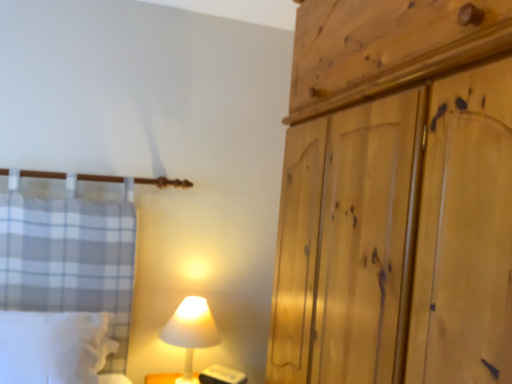
Question: From a real-world perspective, is white matte lamp at lower center positioned above or below white soft pillow at lower left?

Choices:
 (A) below
 (B) above

Answer: (A)

Question: From the image's perspective, is white matte lamp at lower center above or below white soft pillow at lower left?

Choices:
 (A) below
 (B) above

Answer: (A)

Question: Considering the real-world distances, which object is farthest from the white soft pillow at lower left?

Choices:
 (A) natural wood wardrobe at right
 (B) white matte lamp at lower center

Answer: (A)

Question: Based on their relative distances, which object is nearer to the white soft pillow at lower left?

Choices:
 (A) natural wood wardrobe at right
 (B) white matte lamp at lower center

Answer: (B)